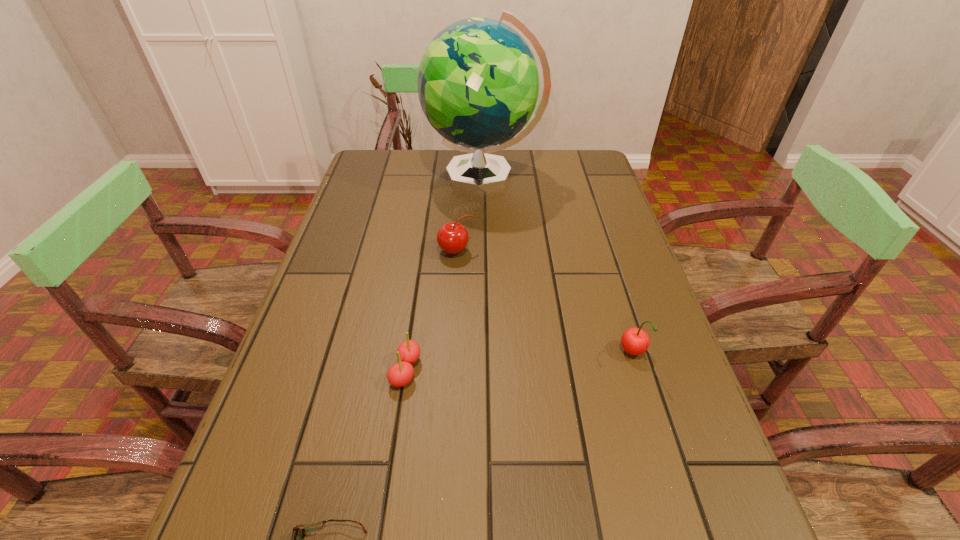
At what (x,y) coordinates should I click in order to perform the action: click on free space that is in between the farthest cherry and the tallest object. Please return your answer as a coordinate pair (x, y). Looking at the image, I should click on (469, 213).

This screenshot has width=960, height=540. In order to click on vacant region between the fourth nearest object and the rightmost object in this screenshot , I will do `click(544, 302)`.

Find the location of a particular element. This screenshot has width=960, height=540. vacant point located between the leftmost cherry and the tallest object is located at coordinates (444, 273).

The image size is (960, 540). Identify the location of free area in between the tallest object and the farthest cherry. pos(469,213).

This screenshot has width=960, height=540. Find the location of `the closest object relative to the rightmost cherry`. the closest object relative to the rightmost cherry is located at coordinates (452, 237).

This screenshot has width=960, height=540. In order to click on object that is the closest one to the tallest object in this screenshot , I will do `click(452, 237)`.

Locate an element on the screen. The height and width of the screenshot is (540, 960). cherry that is the second nearest to the farthest cherry is located at coordinates (635, 341).

This screenshot has height=540, width=960. Identify the location of cherry object that ranks as the second closest to the nearest object. (635, 341).

The width and height of the screenshot is (960, 540). In order to click on blank space that satisfies the following two spatial constraints: 1. on the back side of the rightmost cherry; 2. on the front surface of the tallest object in this screenshot , I will do `click(577, 176)`.

You are a GUI agent. You are given a task and a screenshot of the screen. Output one action in this format:
    pyautogui.click(x=<x>, y=<y>)
    Task: Click on the vacant space that satisfies the following two spatial constraints: 1. on the back side of the rightmost object; 2. on the front surface of the tallest object
    This screenshot has height=540, width=960.
    Given the screenshot: What is the action you would take?
    pyautogui.click(x=577, y=176)